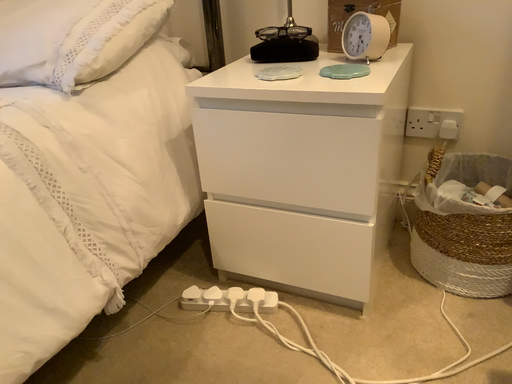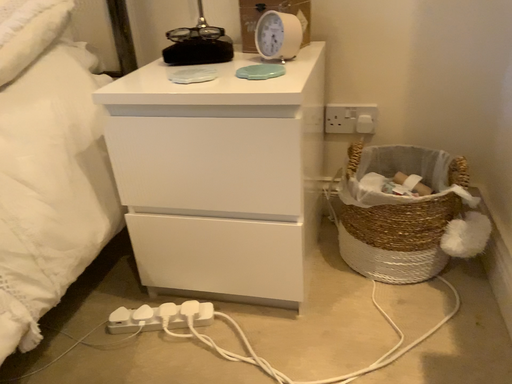
Question: How did the camera likely rotate when shooting the video?

Choices:
 (A) rotated right
 (B) rotated left

Answer: (A)